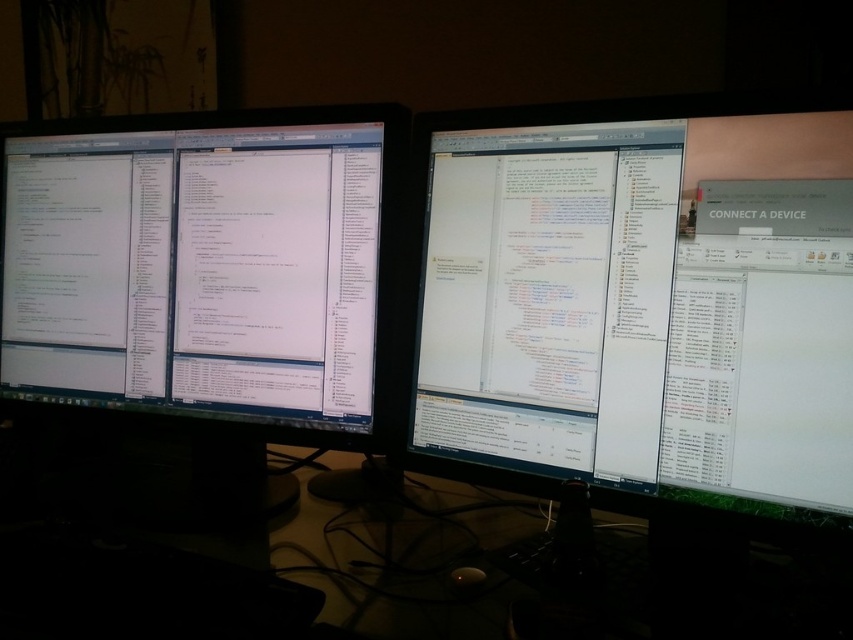
Measure the distance from white glossy monitor at left to black glass computer desk at center.

white glossy monitor at left and black glass computer desk at center are 11.88 inches apart.

Between point (328, 417) and point (648, 596), which one is positioned in front?

Point (648, 596) is more forward.

Is point (109, 284) less distant than point (416, 541)?

No, (109, 284) is behind (416, 541).

This screenshot has height=640, width=853. Identify the location of white glossy monitor at left. (194, 272).

Does white glossy monitor at center appear on the right side of black glass computer desk at center?

Correct, you'll find white glossy monitor at center to the right of black glass computer desk at center.

Who is shorter, white glossy monitor at center or black glass computer desk at center?

With less height is black glass computer desk at center.

Measure the distance between white glossy monitor at center and camera.

They are 27.48 inches apart.

The width and height of the screenshot is (853, 640). I want to click on white glossy monitor at center, so click(x=547, y=298).

Is the position of white glossy monitor at left less distant than that of white glossy monitor at center?

No, white glossy monitor at left is behind white glossy monitor at center.

Is point (146, 164) positioned before point (573, 164)?

No, it is not.

Identify the location of white glossy monitor at left. The image size is (853, 640). (194, 272).

Image resolution: width=853 pixels, height=640 pixels. I want to click on white glossy monitor at left, so click(194, 272).